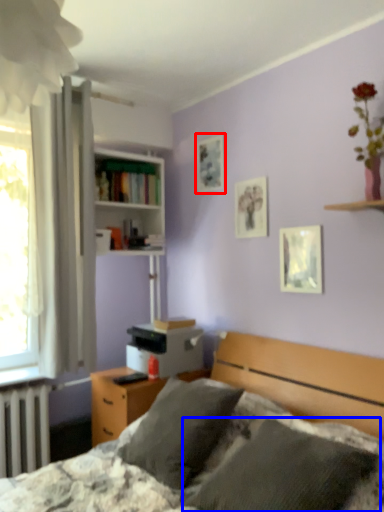
Question: Which object appears closest to the camera in this image, picture frame (highlighted by a red box) or pillow (highlighted by a blue box)?

Choices:
 (A) picture frame
 (B) pillow

Answer: (B)